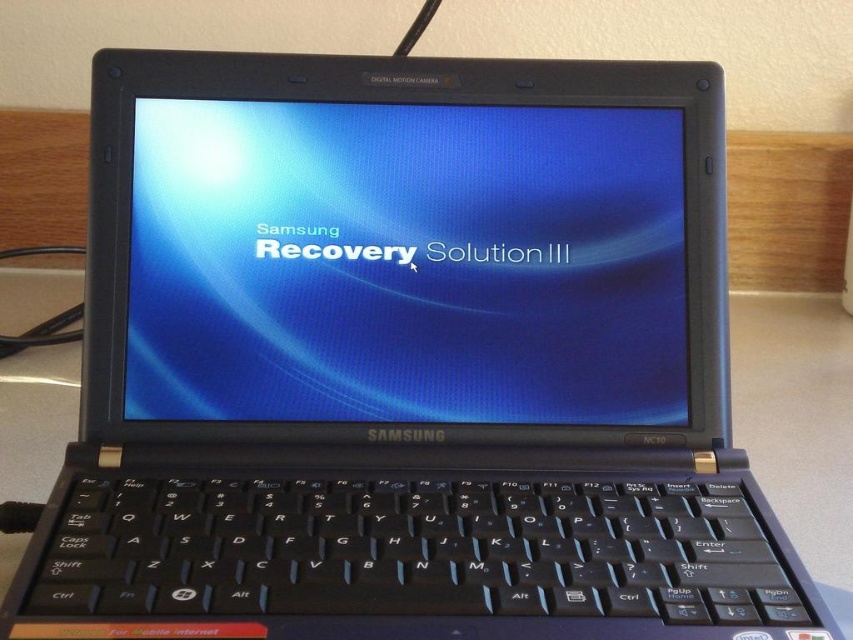
Question: Does blue glossy screen at center appear on the right side of black plastic keyboard at center?

Choices:
 (A) no
 (B) yes

Answer: (A)

Question: Which point is farther from the camera taking this photo?

Choices:
 (A) tap(633, 618)
 (B) tap(136, 186)

Answer: (B)

Question: Is blue glossy screen at center closer to camera compared to black plastic keyboard at center?

Choices:
 (A) no
 (B) yes

Answer: (A)

Question: Which object appears closest to the camera in this image?

Choices:
 (A) blue glossy screen at center
 (B) black plastic keyboard at center

Answer: (B)

Question: Is blue glossy screen at center to the right of black plastic keyboard at center from the viewer's perspective?

Choices:
 (A) yes
 (B) no

Answer: (B)